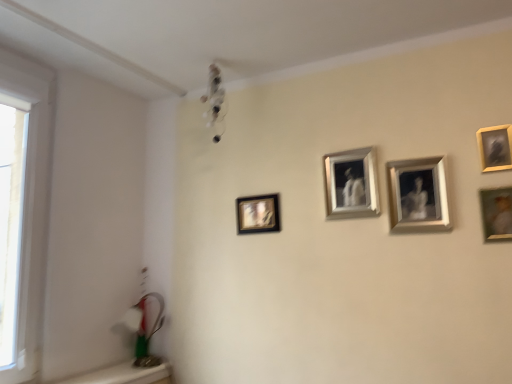
Question: In terms of height, does metallic silver picture frame at upper right, which is the 3th picture frame in left-to-right order, look taller or shorter compared to transparent glass window at left?

Choices:
 (A) tall
 (B) short

Answer: (B)

Question: From the image's perspective, is metallic silver picture frame at upper right, the third picture frame from the right, above or below transparent glass window at left?

Choices:
 (A) above
 (B) below

Answer: (A)

Question: Considering the real-world distances, which object is farthest from the silver metallic frame at center, the 2th picture frame positioned from the left?

Choices:
 (A) transparent glass window at left
 (B) matte silver picture frame at right, marked as the 5th picture frame in a left-to-right arrangement
 (C) wooden frame at upper right, which is counted as the second picture frame, starting from the right
 (D) matte black picture frame at center left, positioned as the 5th picture frame in right-to-left order
 (E) metallic silver picture frame at upper right, which is the 3th picture frame in left-to-right order

Answer: (A)

Question: Which object is positioned closest to the wooden frame at upper right, which is counted as the second picture frame, starting from the right?

Choices:
 (A) transparent glass window at left
 (B) matte black picture frame at center left, the first picture frame from the left
 (C) metallic silver picture frame at upper right, which is the 3th picture frame in left-to-right order
 (D) silver metallic frame at center, the 2th picture frame positioned from the left
 (E) matte silver picture frame at right, marked as the 1th picture frame in a right-to-left arrangement

Answer: (E)